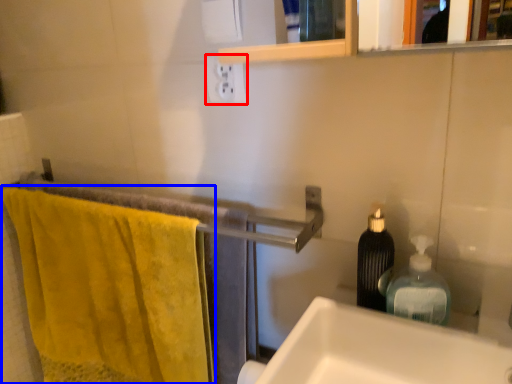
Question: Among these objects, which one is nearest to the camera, electric outlet (highlighted by a red box) or bath towel (highlighted by a blue box)?

Choices:
 (A) electric outlet
 (B) bath towel

Answer: (B)